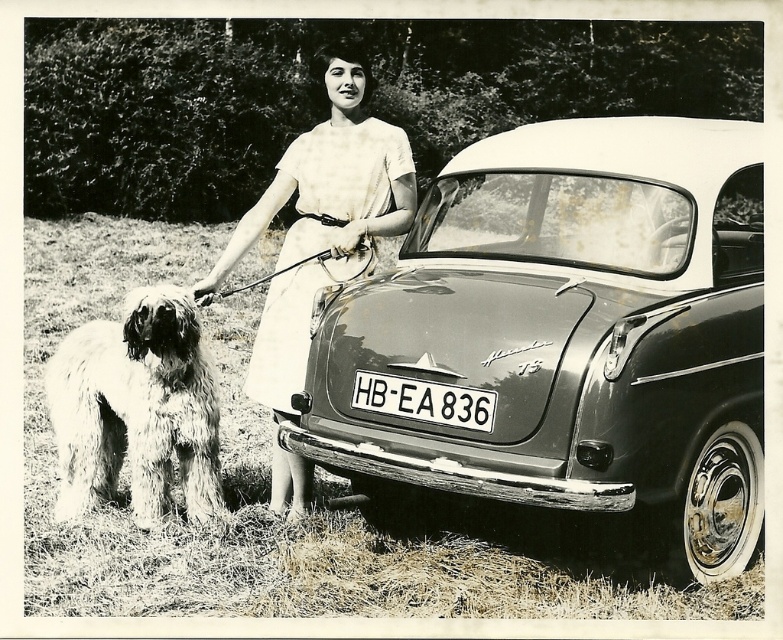
Based on the scene description, where is the shiny black car at center located in terms of coordinates?

The shiny black car at center is located at coordinates point (572, 337).

You are a photographer trying to capture the woman in the white cotton dress at center. You want to focus on her face while ensuring the vintage car and the dog are still visible in the frame. Where should you position your camera relative to the point marked at coordinates point (320, 220)?

Position the camera slightly to the left of point (320, 220) to focus on the woman in the white cotton dress at center while keeping the vintage car and the dog in the frame.

You are a photographer who wants to take a closeup of the shiny black car at center and the white cotton dress at center. Which object should you focus on first to ensure it is in sharp focus?

The shiny black car at center is closer to the viewer than the white cotton dress at center, so you should focus on the shiny black car at center first to ensure it is in sharp focus.